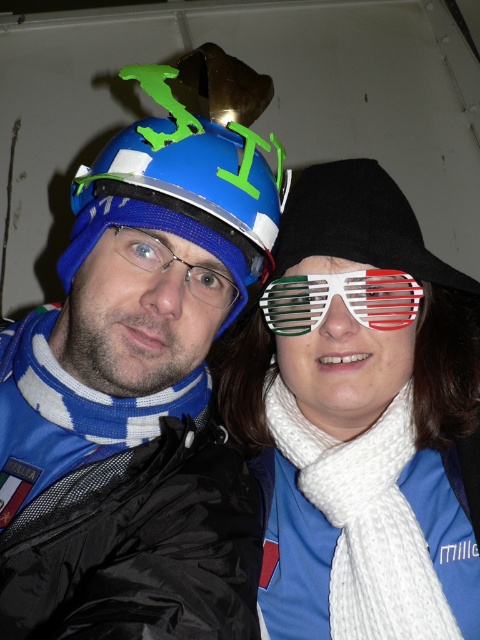
You are a photographer trying to capture a closeup shot of both the blue matte helmet at left and the black fabric hat at center. The camera you are using has a minimum focusing distance of 5 inches. Can you take the photo without moving either object?

The blue matte helmet at left and the black fabric hat at center are 4.54 inches apart from each other, which is within the camera minimum focusing distance of 5 inches. Therefore, the photographer can take the photo without moving either object.

You are taking a photo of two people in a vehicle. You want to place a sticker on the exact spot between the two points labeled point [238,93] and point [307,209]. According to the image, which point is closer to the camera so that you can place the sticker in front of both points?

Point [307,209] is closer to the camera than point [238,93], so placing the sticker in front of point [307,209] will ensure it is in front of both points.

You are a photographer setting up a portrait session. You notice two white knitted scarves in the scene. Which one is taller, the white knitted scarf at center or the white knitted scarf at right?

The white knitted scarf at center is taller than the white knitted scarf at right according to the description.